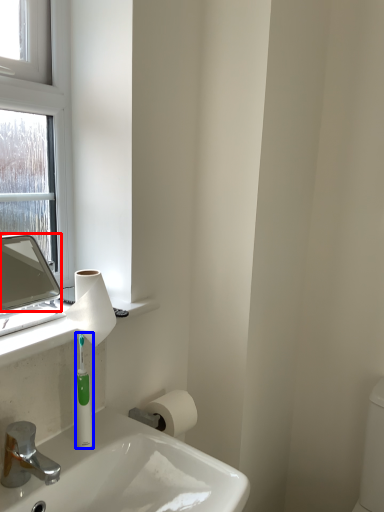
Question: Which object is further to the camera taking this photo, mirror (highlighted by a red box) or mouthwash (highlighted by a blue box)?

Choices:
 (A) mirror
 (B) mouthwash

Answer: (B)